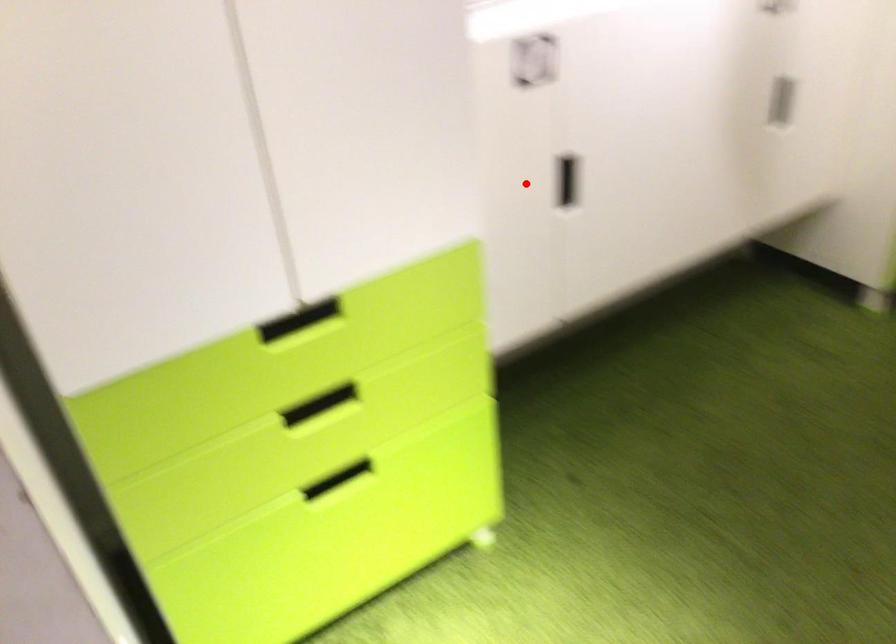
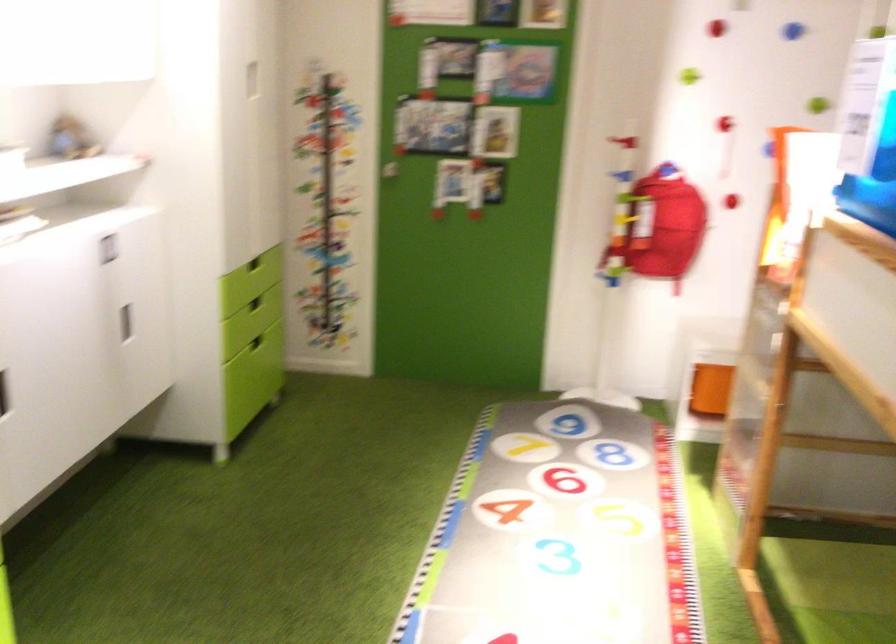
Question: I am providing you with two images of the same scene from different viewpoints. A red point is marked on the first image. Can you still see the location of the red point in image 2?

Choices:
 (A) Yes
 (B) No

Answer: (A)